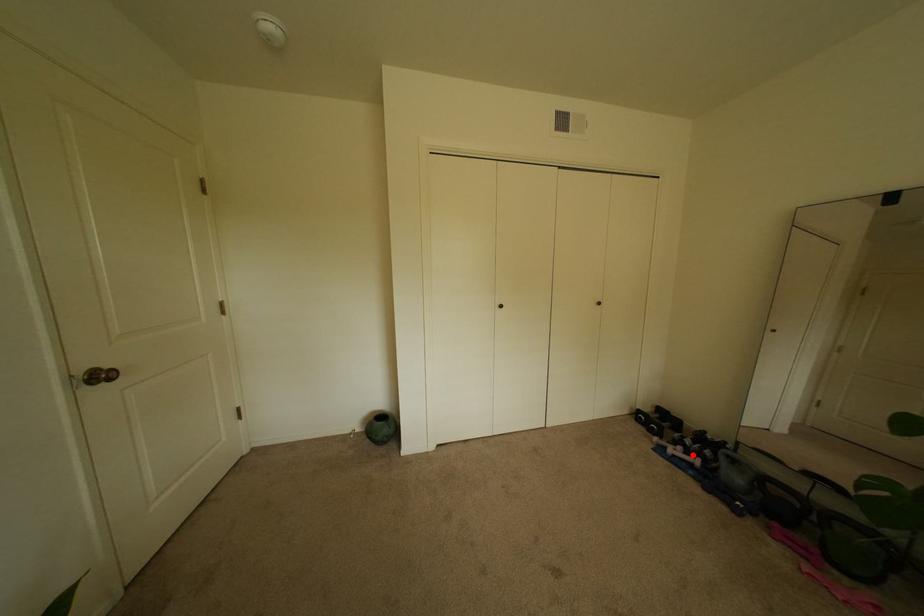
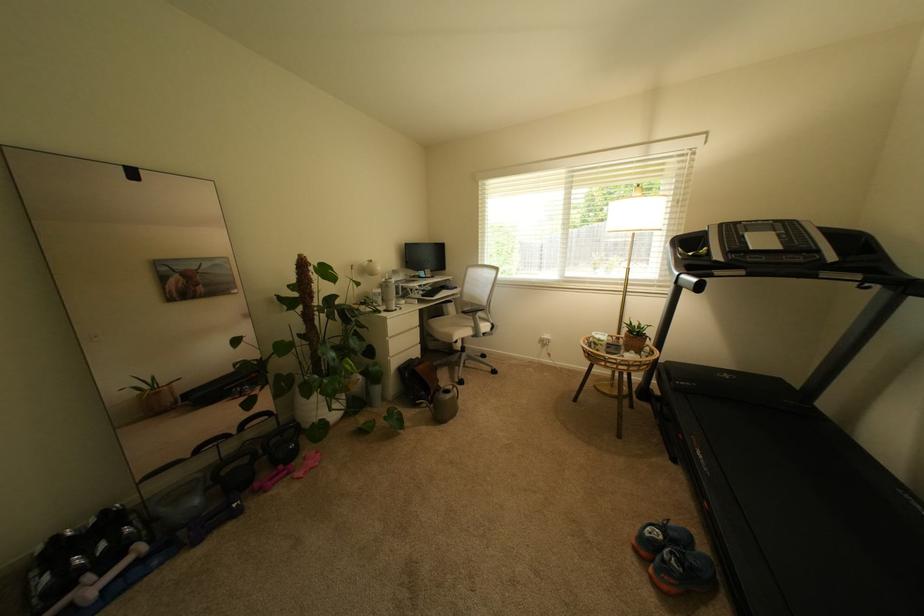
Question: I am providing you with two images of the same scene from different viewpoints. In image1, a red point is highlighted. Considering the same 3D point in image2, which of the following is correct?

Choices:
 (A) It is closer
 (B) It is farther

Answer: (A)